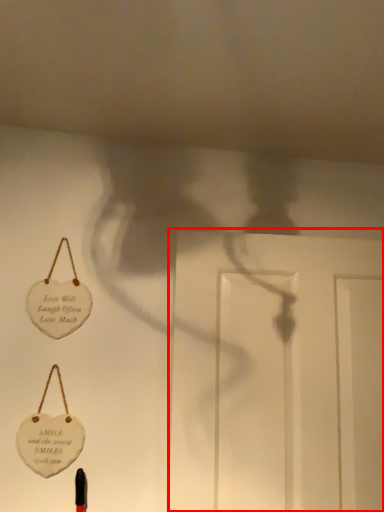
Question: Considering the relative positions of door (annotated by the red box) and badge in the image provided, where is door (annotated by the red box) located with respect to the staircase?

Choices:
 (A) right
 (B) left

Answer: (A)